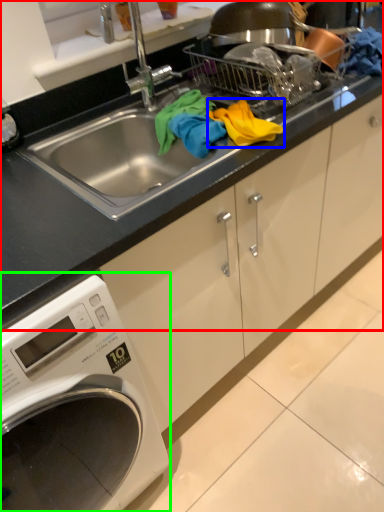
Question: Which object is positioned farthest from countertop (highlighted by a red box)? Select from material (highlighted by a blue box) and washing machine (highlighted by a green box).

Choices:
 (A) material
 (B) washing machine

Answer: (B)